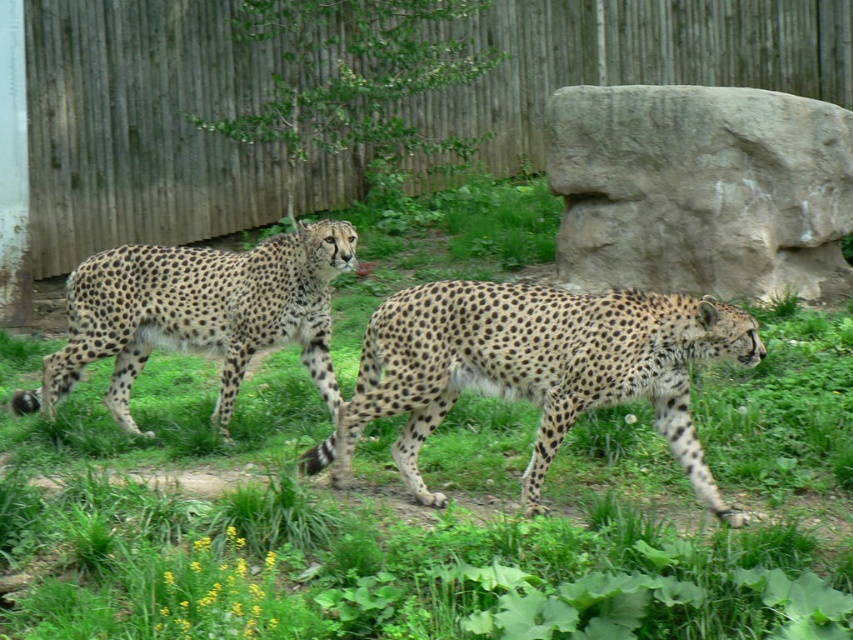
You are a zookeeper who needs to place a feeding station between the gray stone boulder at right and the spotted fur cheetah at center. The feeding station requires a minimum of 4 meters of space to be placed safely. Can you place it there?

The gray stone boulder at right is 3.58 meters from the spotted fur cheetah at center. Since the required space is 4 meters, the feeding station cannot be placed between them safely.

You are a zookeeper standing at the camera position and want to feed the spotted fur cheetah at center. If your feeding tool has a maximum reach of 15 feet, can you reach the cheetah?

The distance between the spotted fur cheetah at center and the camera is 16.15 feet, which exceeds the feeding tool reach of 15 feet. Therefore, you cannot reach the cheetah.